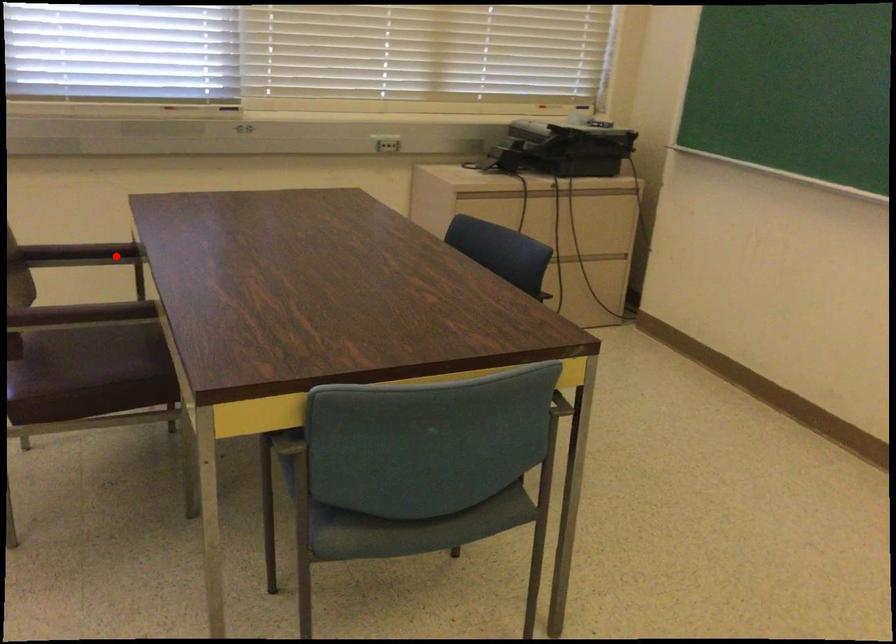
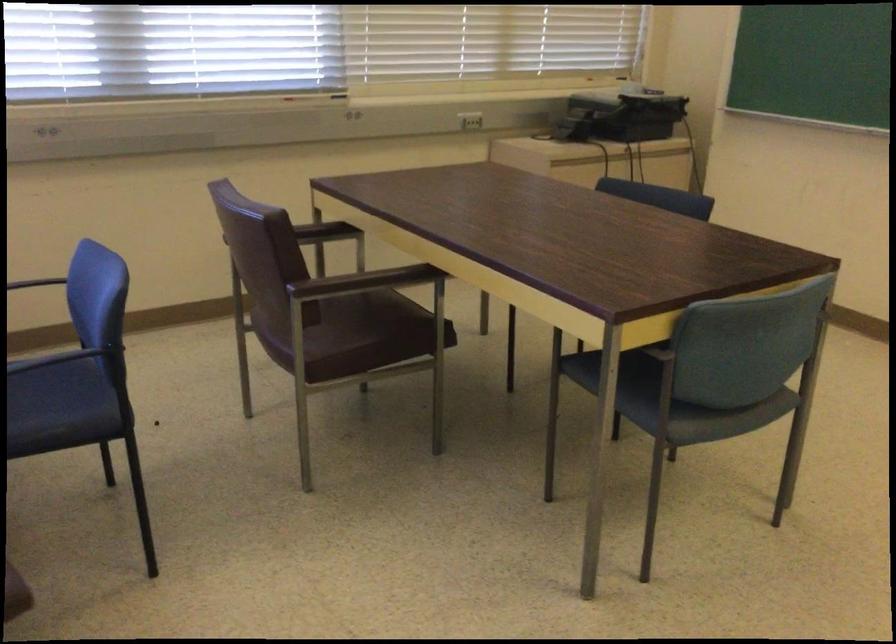
In the second image, find the point that corresponds to the highlighted location in the first image.

(323, 232)